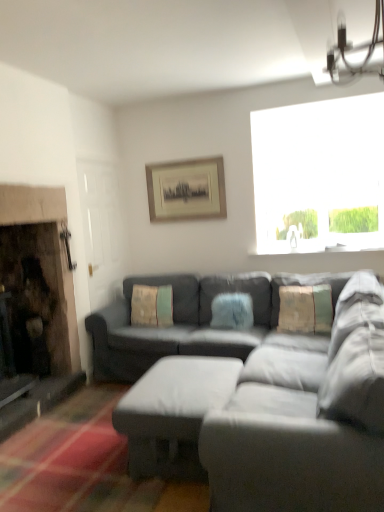
The width and height of the screenshot is (384, 512). Identify the location of empty space that is ontop of matte black picture frame at upper center (from a real-world perspective). (187, 160).